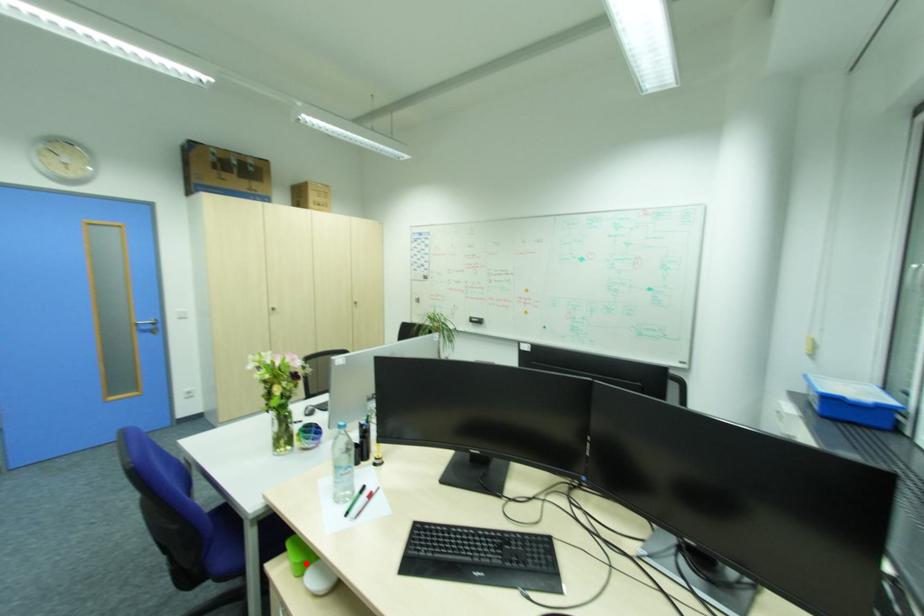
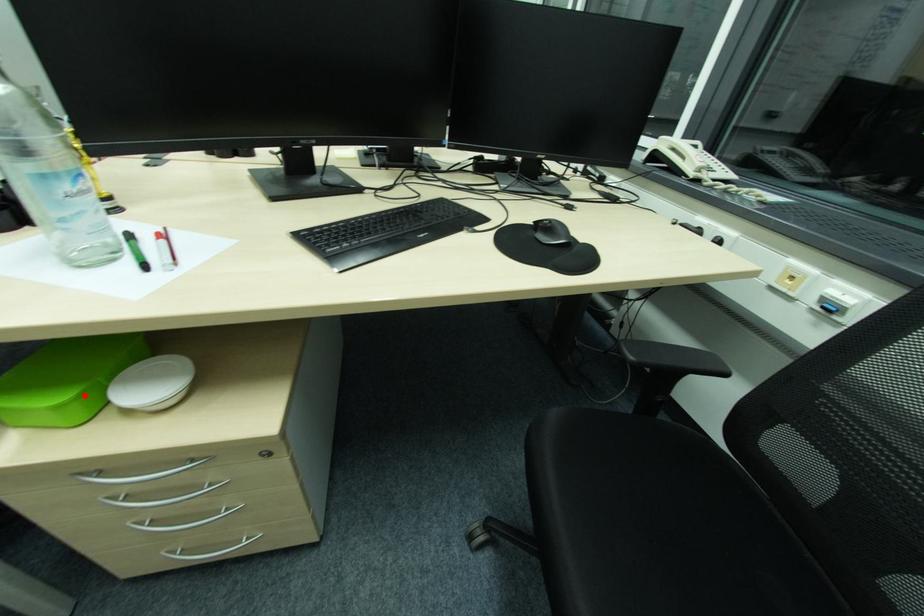
I am providing you with two images of the same scene from different viewpoints. A red point is marked on the first image and another point is marked on the second image. Is the marked point in image1 the same physical position as the marked point in image2?

Yes